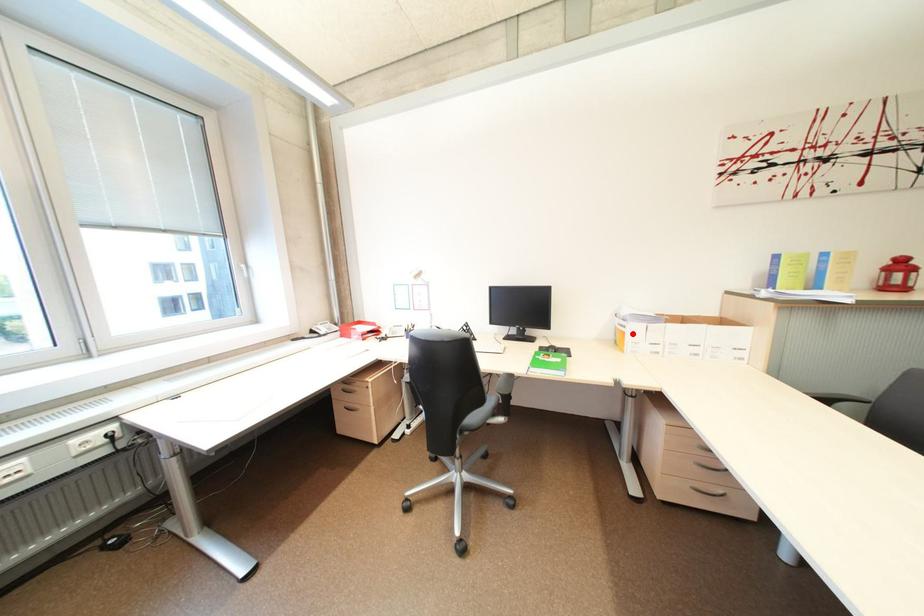
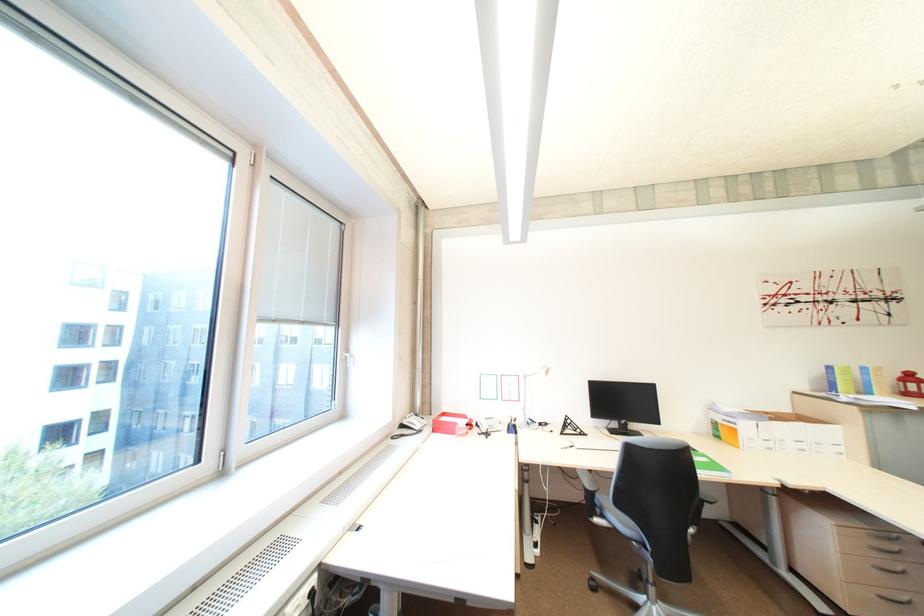
Where in the second image is the point corresponding to the highlighted location from the first image?

(745, 431)